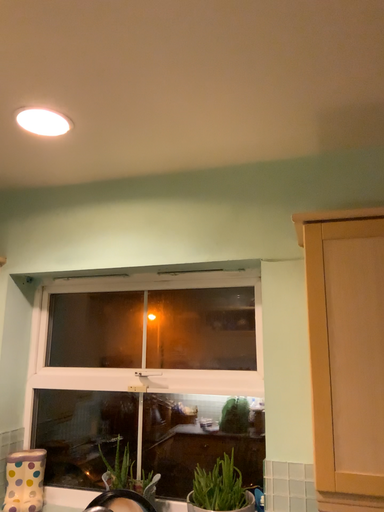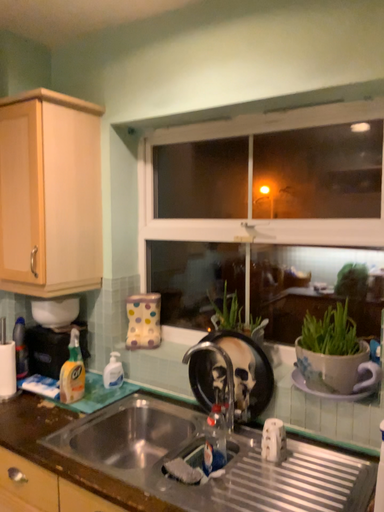
Question: How did the camera likely rotate when shooting the video?

Choices:
 (A) rotated right
 (B) rotated left

Answer: (B)